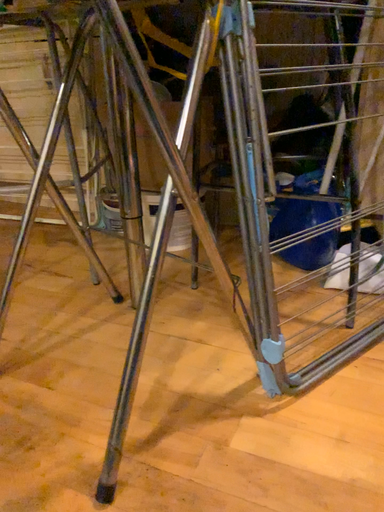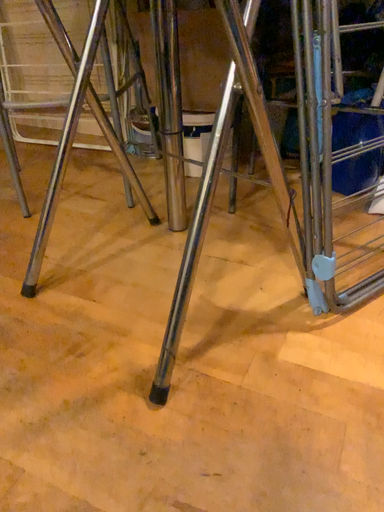
Question: How did the camera likely rotate when shooting the video?

Choices:
 (A) rotated downward
 (B) rotated upward

Answer: (A)